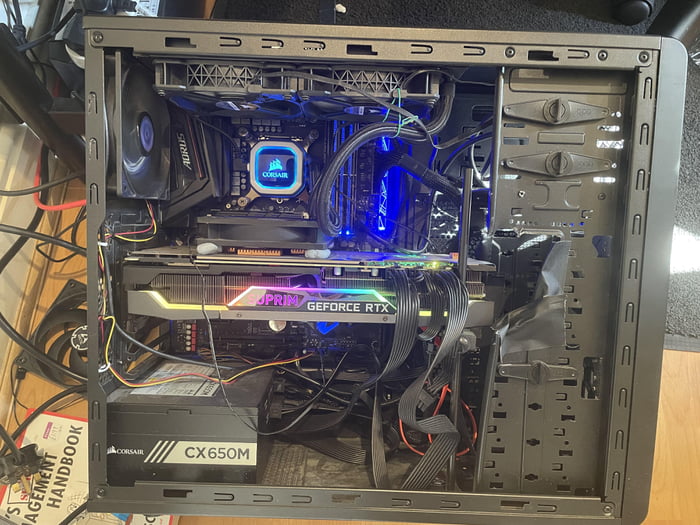
You are a GUI agent. You are given a task and a screenshot of the screen. Output one action in this format:
    pyautogui.click(x=<x>, y=<y>)
    Task: Click on the white on carpet
    
    Given the screenshot: What is the action you would take?
    pyautogui.click(x=690, y=256)